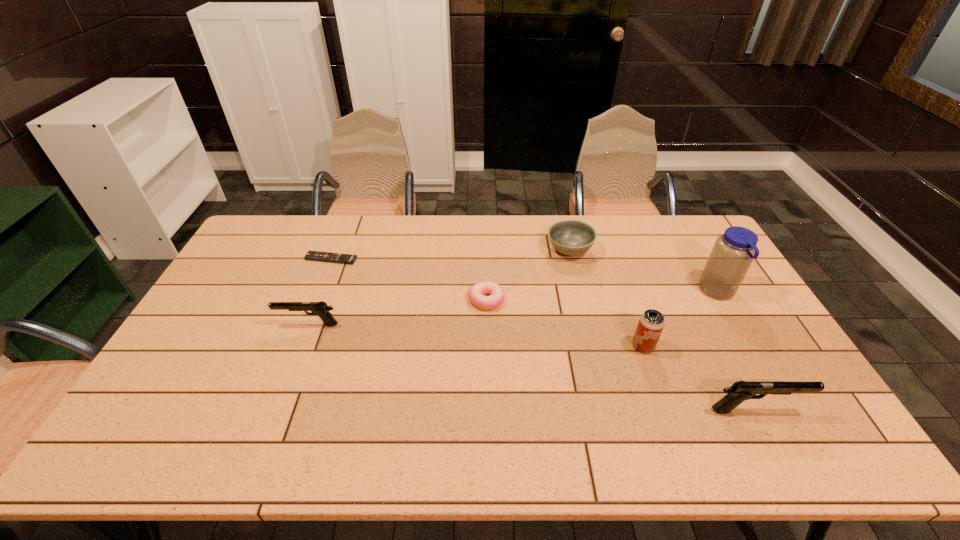
Where is `free space between the fifth object from right to left and the shortest object`? The image size is (960, 540). free space between the fifth object from right to left and the shortest object is located at coordinates (409, 279).

At what (x,y) coordinates should I click in order to perform the action: click on free point between the shortest object and the shorter gun. Please return your answer as a coordinate pair (x, y). This screenshot has height=540, width=960. Looking at the image, I should click on (320, 292).

This screenshot has height=540, width=960. What are the coordinates of `free space between the taller gun and the water bottle` in the screenshot? It's located at (736, 351).

Where is `empty space that is in between the tallest object and the left gun`? The image size is (960, 540). empty space that is in between the tallest object and the left gun is located at coordinates (513, 308).

Where is `free space between the right gun and the left gun`? free space between the right gun and the left gun is located at coordinates (532, 367).

Point out which object is positioned as the second nearest to the beer can. Please provide its 2D coordinates. Your answer should be formatted as a tuple, i.e. [(x, y)], where the tuple contains the x and y coordinates of a point satisfying the conditions above.

[(733, 252)]

This screenshot has width=960, height=540. I want to click on object that stands as the closest to the doughnut, so click(x=571, y=238).

Find the location of a particular element. This screenshot has height=540, width=960. vacant space that satisfies the following two spatial constraints: 1. at the aiming end of the fourth tallest object; 2. on the back side of the beer can is located at coordinates (300, 346).